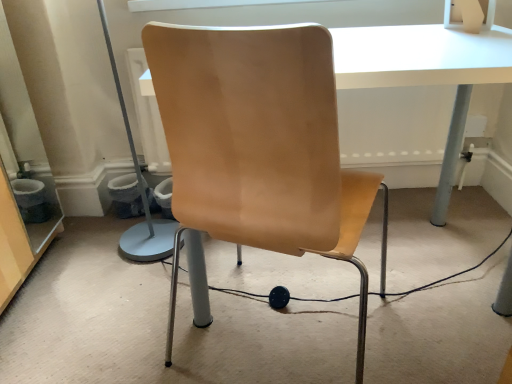
I want to click on empty space that is in between white glossy table at center and matte wood chair at center, so click(x=408, y=356).